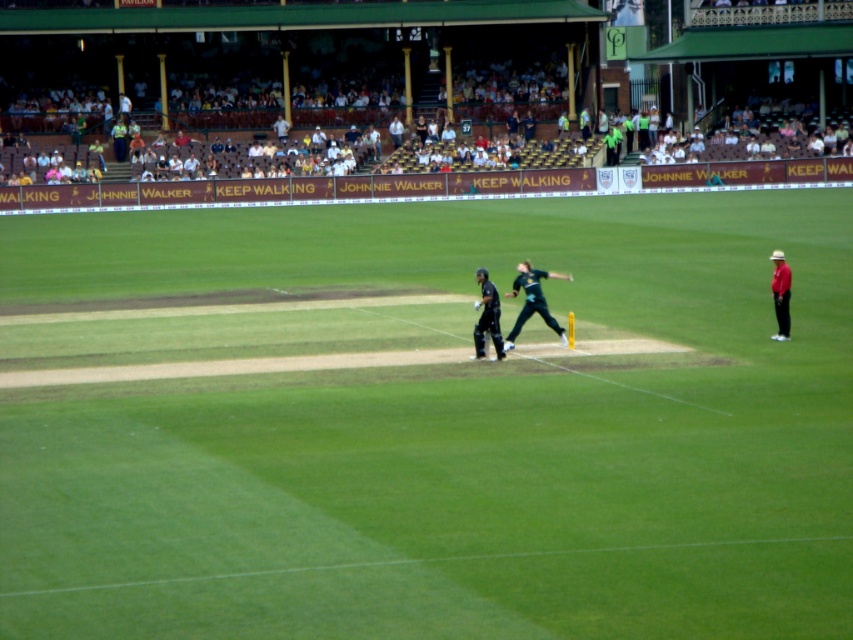
Question: Considering the relative positions of green grass pitch at center and dark green uniform at center in the image provided, where is green grass pitch at center located with respect to dark green uniform at center?

Choices:
 (A) right
 (B) left

Answer: (B)

Question: Is dark green uniform at center bigger than red shirt at right?

Choices:
 (A) yes
 (B) no

Answer: (B)

Question: Is green grass pitch at center positioned before dark green uniform at center?

Choices:
 (A) no
 (B) yes

Answer: (B)

Question: Which of these objects is positioned farthest from the red shirt at right?

Choices:
 (A) green grass pitch at center
 (B) dark green jersey at center

Answer: (A)

Question: Which object is positioned closest to the dark green jersey at center?

Choices:
 (A) dark green uniform at center
 (B) red shirt at right
 (C) green grass pitch at center

Answer: (A)

Question: Estimate the real-world distances between objects in this image. Which object is farther from the dark green uniform at center?

Choices:
 (A) dark green jersey at center
 (B) red shirt at right

Answer: (B)